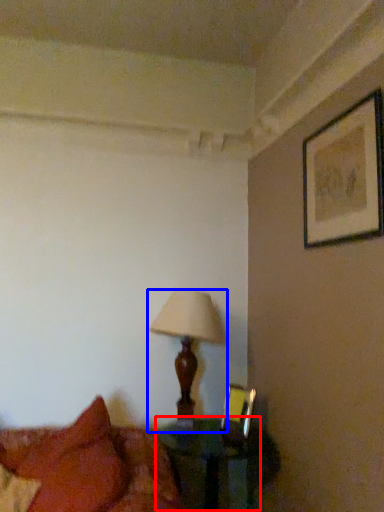
Question: Which of the following is the farthest to the observer, table (highlighted by a red box) or lamp (highlighted by a blue box)?

Choices:
 (A) table
 (B) lamp

Answer: (B)